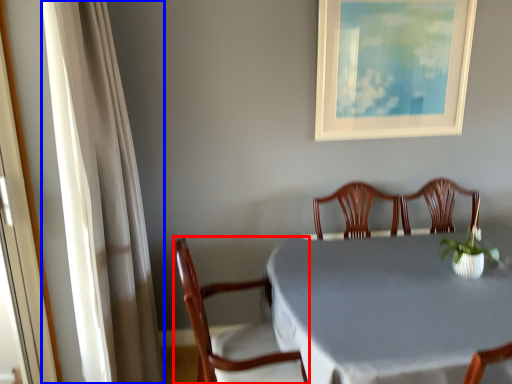
Question: Which object is further to the camera taking this photo, chair (highlighted by a red box) or curtain (highlighted by a blue box)?

Choices:
 (A) chair
 (B) curtain

Answer: (A)